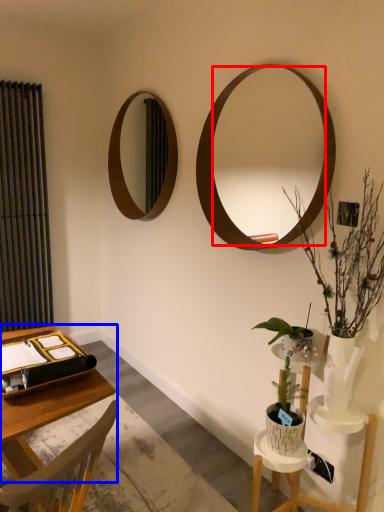
Question: Which object appears closest to the camera in this image, mirror (highlighted by a red box) or vanity (highlighted by a blue box)?

Choices:
 (A) mirror
 (B) vanity

Answer: (B)